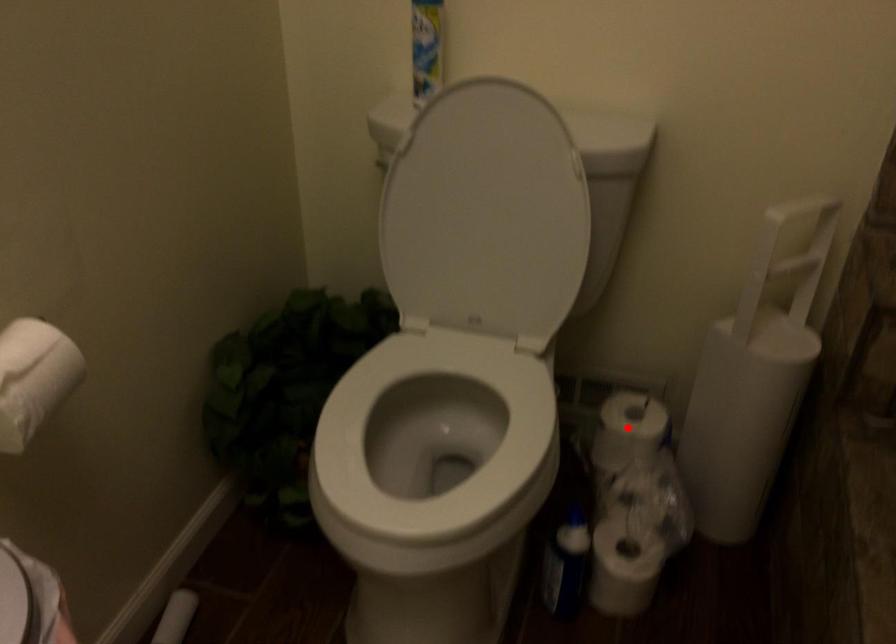
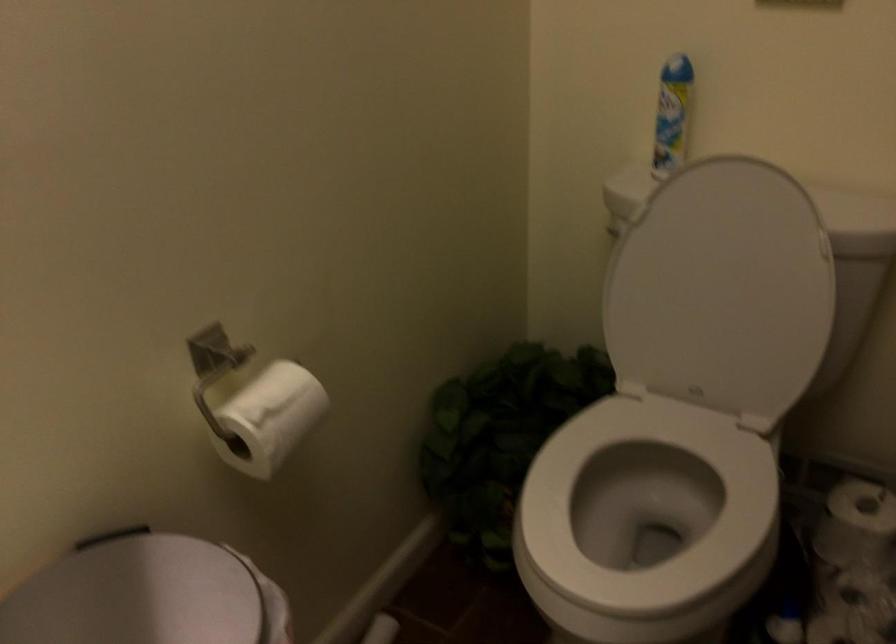
The point at the highlighted location is marked in the first image. Where is the corresponding point in the second image?

(856, 523)